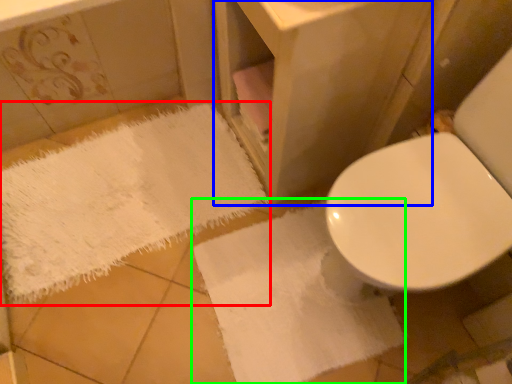
Question: Which is nearer to the bath towel (highlighted by a red box)? vanity (highlighted by a blue box) or bath towel (highlighted by a green box).

Choices:
 (A) vanity
 (B) bath towel

Answer: (B)